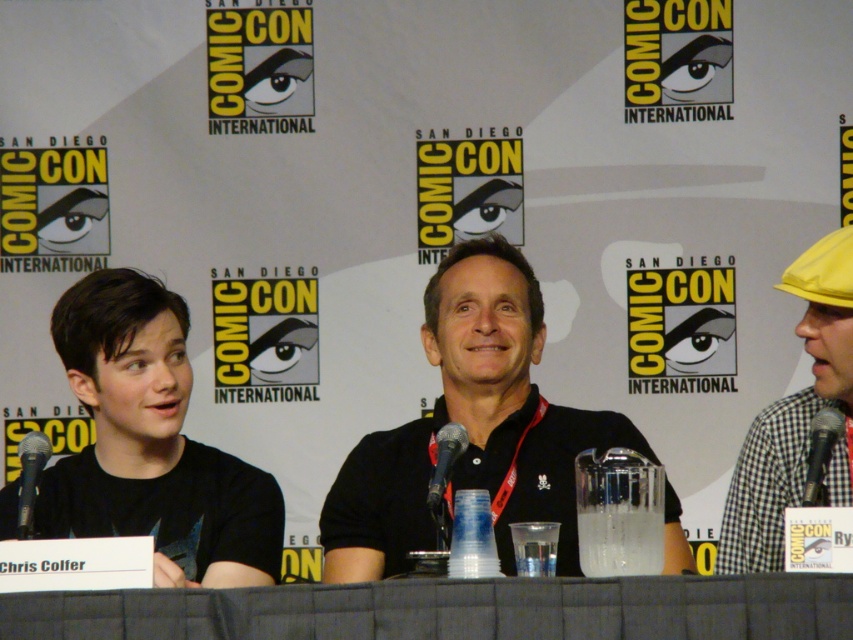
Does gray fabric table at center appear on the left side of black metallic microphone at right?

Correct, you'll find gray fabric table at center to the left of black metallic microphone at right.

Is gray fabric table at center to the right of black metallic microphone at right from the viewer's perspective?

No, gray fabric table at center is not to the right of black metallic microphone at right.

What do you see at coordinates (451, 609) in the screenshot? The image size is (853, 640). I see `gray fabric table at center` at bounding box center [451, 609].

You are a GUI agent. You are given a task and a screenshot of the screen. Output one action in this format:
    pyautogui.click(x=<x>, y=<y>)
    Task: Click on the gray fabric table at center
    
    Given the screenshot: What is the action you would take?
    pyautogui.click(x=451, y=609)

Between point (828, 500) and point (433, 500), which one is positioned in front?

Point (433, 500)

Which is more to the left, black metallic microphone at right or black metallic microphone at center?

Positioned to the left is black metallic microphone at center.

This screenshot has height=640, width=853. I want to click on black metallic microphone at right, so click(x=820, y=452).

Can you confirm if black matte shirt at left is bigger than black metallic microphone at right?

Indeed, black matte shirt at left has a larger size compared to black metallic microphone at right.

From the picture: Does black matte shirt at left have a greater width compared to black metallic microphone at right?

Yes, black matte shirt at left is wider than black metallic microphone at right.

The width and height of the screenshot is (853, 640). What are the coordinates of `black matte shirt at left` in the screenshot? It's located at (151, 444).